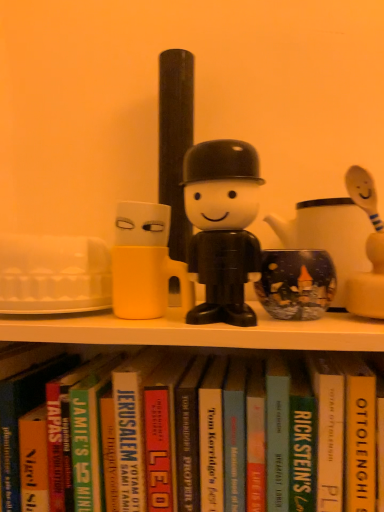
Question: Is hardcover book at center, arranged as the second paperback book when viewed from the left, wider or thinner than yellow hardcover book at center, arranged as the 1th paperback book when viewed from the right?

Choices:
 (A) thin
 (B) wide

Answer: (B)

Question: From a real-world perspective, is hardcover book at center, arranged as the second paperback book when viewed from the left, positioned above or below yellow hardcover book at center, arranged as the 1th paperback book when viewed from the right?

Choices:
 (A) above
 (B) below

Answer: (B)

Question: Estimate the real-world distances between objects in this image. Which object is farther from the hardcover book at center, which is counted as the fourth paperback book, starting from the right?

Choices:
 (A) yellow hardcover book at center, arranged as the 1th paperback book when viewed from the right
 (B) hardcover book at center, the fifth paperback book when ordered from right to left
 (C) green matte paperback book at center, marked as the fifth paperback book in a left-to-right arrangement
 (D) hardcover book at center, which is counted as the 6th paperback book, starting from the right
 (E) hardcover book at center, placed as the third paperback book when sorted from right to left

Answer: (A)

Question: Estimate the real-world distances between objects in this image. Which object is closer to the yellow hardcover book at center, arranged as the 1th paperback book when viewed from the right?

Choices:
 (A) hardcover book at center, the fifth paperback book when ordered from right to left
 (B) hardcover book at center, the 1th paperback book positioned from the left
 (C) hardcover book at center, positioned as the third paperback book in left-to-right order
 (D) hardcover book at center, marked as the fourth paperback book in a left-to-right arrangement
 (E) green matte paperback book at center, marked as the fifth paperback book in a left-to-right arrangement

Answer: (E)